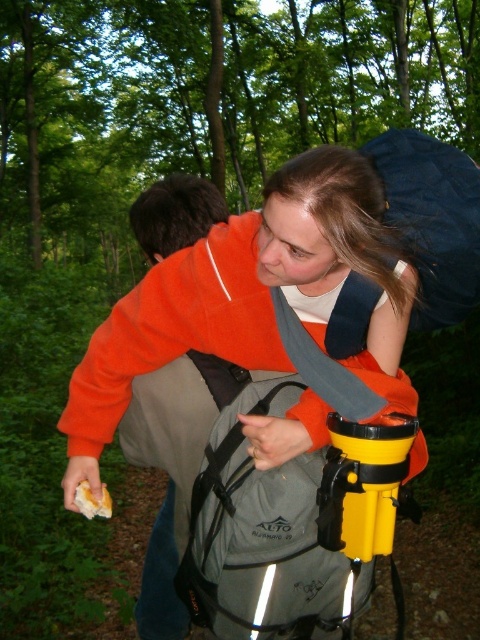
You are a hiker planning to carry both the orange fleece jacket at upper left and the navy blue fabric backpack at upper right. Which item should you choose to prioritize packing if you have limited space?

The orange fleece jacket at upper left is bigger than the navy blue fabric backpack at upper right, so you should prioritize packing the navy blue fabric backpack at upper right first to save space.

You are a hiker who needs to pass between two orange fleece jackets in the forest. The jackets are labeled as orange fleece jacket at center and orange fleece jacket at upper left. Given that your backpack is 12 inches wide, will you be able to fit through the space between them?

The distance between the orange fleece jacket at center and the orange fleece jacket at upper left is 11.57 inches. Since your backpack is 12 inches wide, it is slightly wider than the available space. You may need to adjust your position or choose a different path to avoid getting stuck.